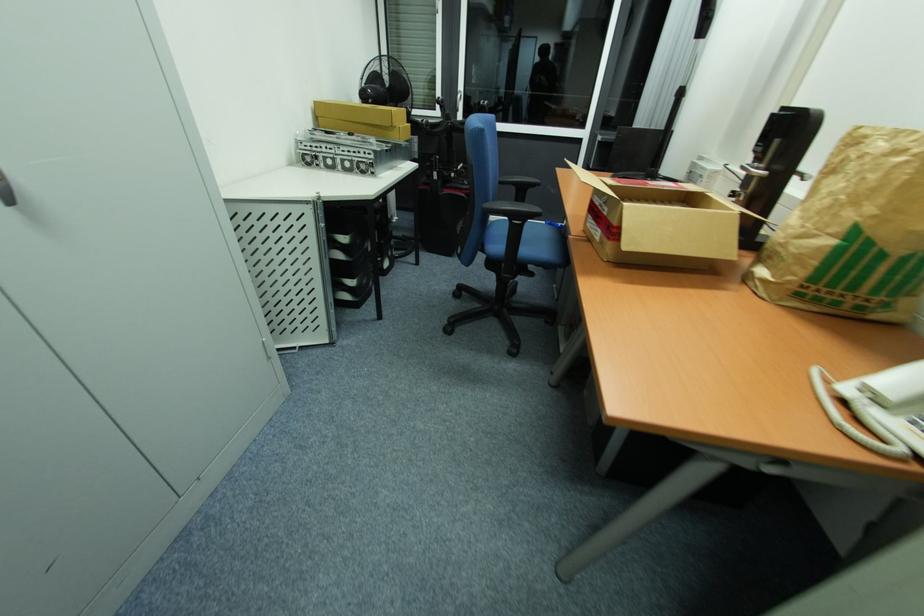
Image resolution: width=924 pixels, height=616 pixels. I want to click on silver device knob, so click(x=6, y=191).